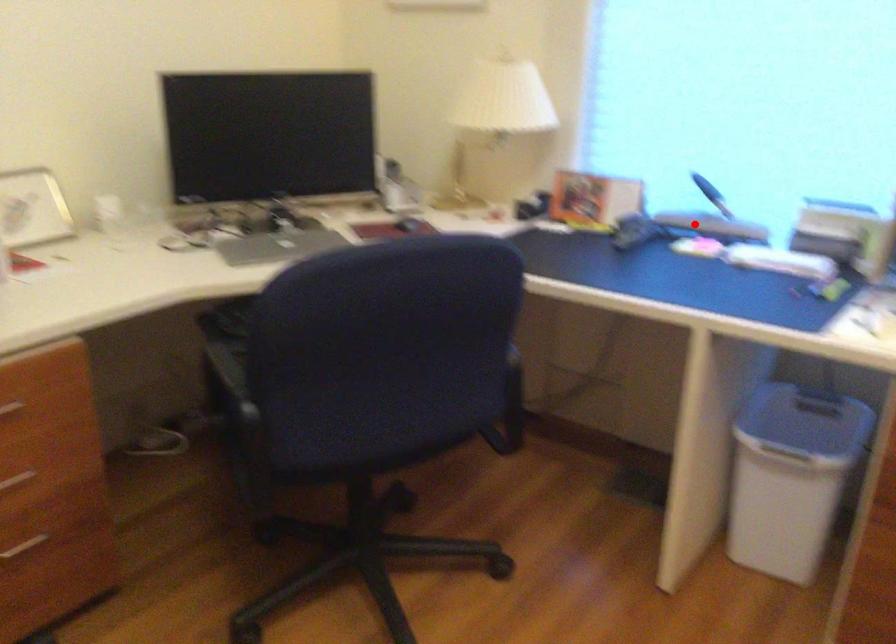
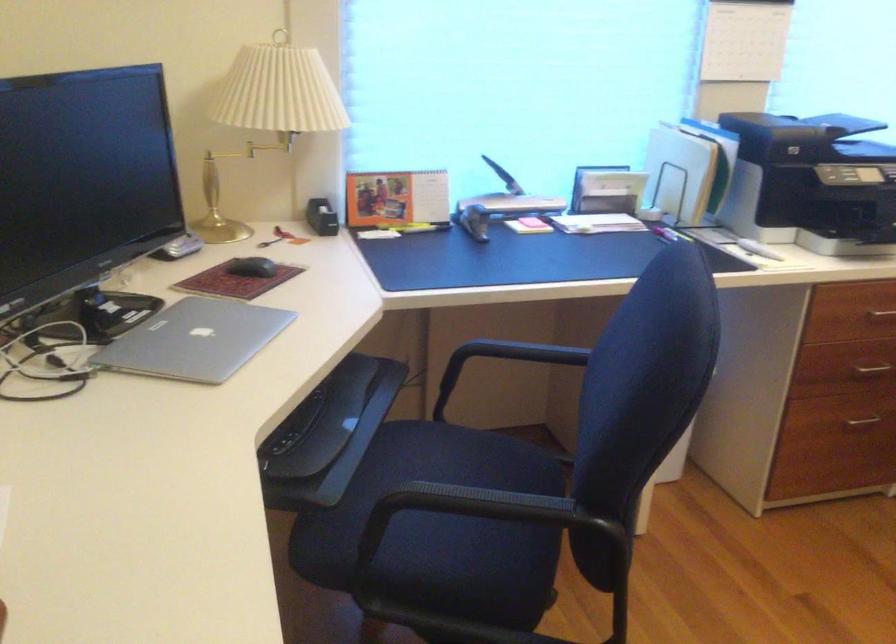
Locate, in the second image, the point that corresponds to the highlighted location in the first image.

(502, 205)